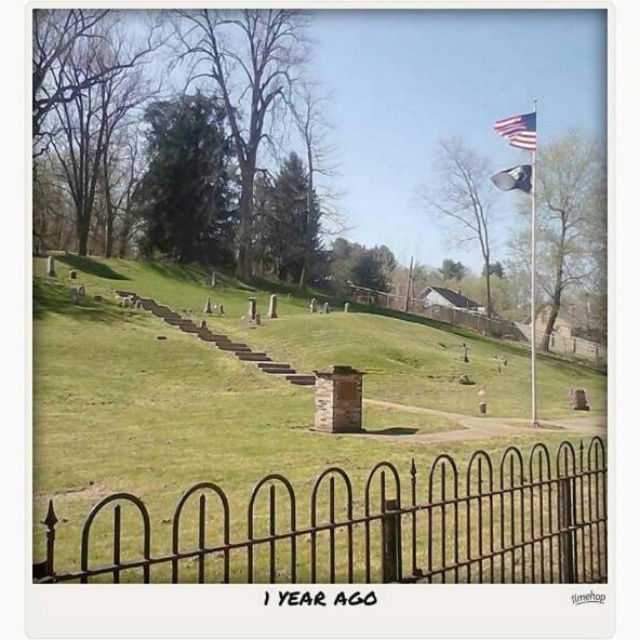
Question: Which object is the closest to the metallic flag pole at upper right?

Choices:
 (A) silky blue flag at upper right
 (B) green grassy hillside at center

Answer: (B)

Question: Does green grassy hillside at center have a larger size compared to metallic flag pole at upper right?

Choices:
 (A) no
 (B) yes

Answer: (A)

Question: Is green grassy hillside at center thinner than silky blue flag at upper right?

Choices:
 (A) yes
 (B) no

Answer: (B)

Question: Which point is closer to the camera taking this photo?

Choices:
 (A) tap(540, 563)
 (B) tap(524, 172)
 (C) tap(534, 353)

Answer: (A)

Question: Which of the following is the closest to the observer?

Choices:
 (A) metallic flag pole at upper right
 (B) green grassy hillside at center

Answer: (B)

Question: Does green grassy hillside at center appear on the right side of silky blue flag at upper right?

Choices:
 (A) no
 (B) yes

Answer: (A)